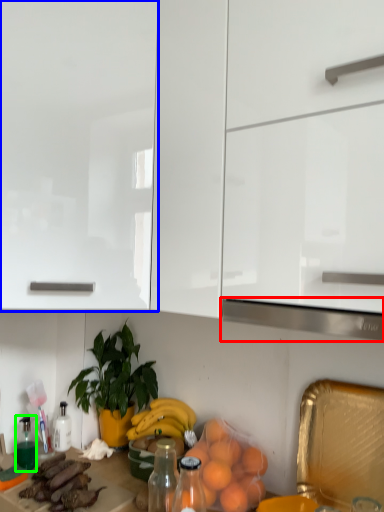
Question: Estimate the real-world distances between objects in this image. Which object is closer to exhaust hood (highlighted by a red box), cabinetry (highlighted by a blue box) or bottle (highlighted by a green box)?

Choices:
 (A) cabinetry
 (B) bottle

Answer: (A)